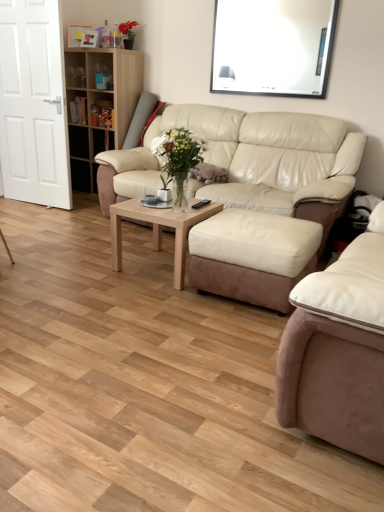
Question: Looking at their shapes, would you say beige leather couch at center, the second studio couch viewed from the back, is wider or thinner than wooden bookshelf at upper left?

Choices:
 (A) wide
 (B) thin

Answer: (A)

Question: Is beige leather couch at center, the second studio couch viewed from the back, taller or shorter than wooden bookshelf at upper left?

Choices:
 (A) tall
 (B) short

Answer: (B)

Question: Which of these objects is positioned closest to the beige leather couch at center, the 2th studio couch positioned from the front?

Choices:
 (A) light brown wood coffee table at center
 (B) beige leather couch at center, the second studio couch viewed from the back
 (C) white glossy window screen at upper center
 (D) white glossy door at left
 (E) wooden bookshelf at upper left

Answer: (A)

Question: Considering the real-world distances, which object is closest to the light brown wood coffee table at center?

Choices:
 (A) beige leather couch at center, the second studio couch viewed from the back
 (B) wooden bookshelf at upper left
 (C) beige leather couch at center, the 2th studio couch positioned from the front
 (D) white glossy door at left
 (E) white glossy window screen at upper center

Answer: (C)